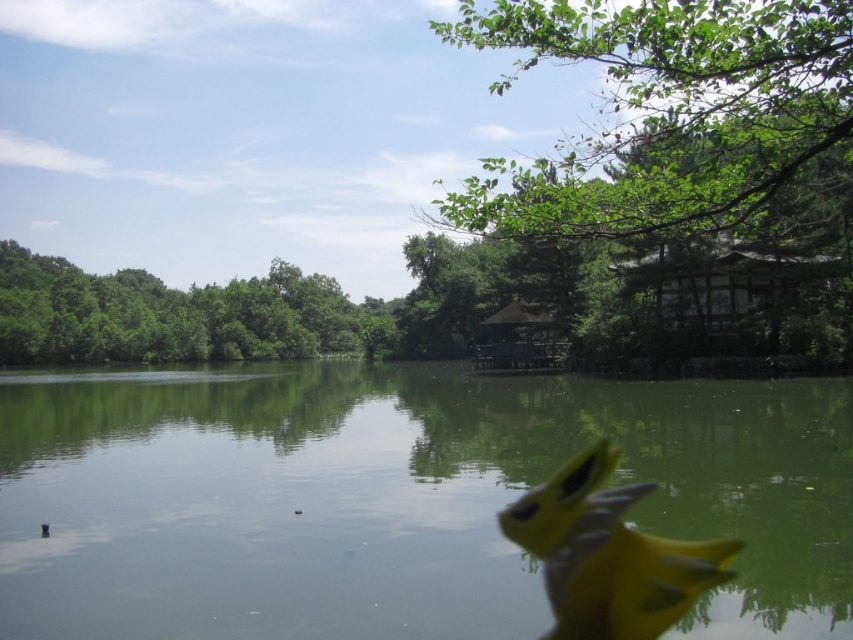
Question: Can you confirm if green smooth water at center is wider than yellow matte bird at center?

Choices:
 (A) no
 (B) yes

Answer: (B)

Question: Can you confirm if green leafy tree at upper right is positioned above yellow matte bird at center?

Choices:
 (A) no
 (B) yes

Answer: (B)

Question: Among these points, which one is nearest to the camera?

Choices:
 (A) (233, 310)
 (B) (694, 28)
 (C) (256, 428)
 (D) (624, 579)

Answer: (B)

Question: Among these objects, which one is farthest from the camera?

Choices:
 (A) green smooth water at center
 (B) yellow matte bird at center
 (C) green leafy tree at upper right
 (D) green leafy trees at upper left

Answer: (D)

Question: Which of the following is the closest to the observer?

Choices:
 (A) (10, 380)
 (B) (166, 289)
 (C) (616, 449)
 (D) (762, 36)

Answer: (D)

Question: Can you confirm if green smooth water at center is thinner than green leafy trees at upper left?

Choices:
 (A) yes
 (B) no

Answer: (A)